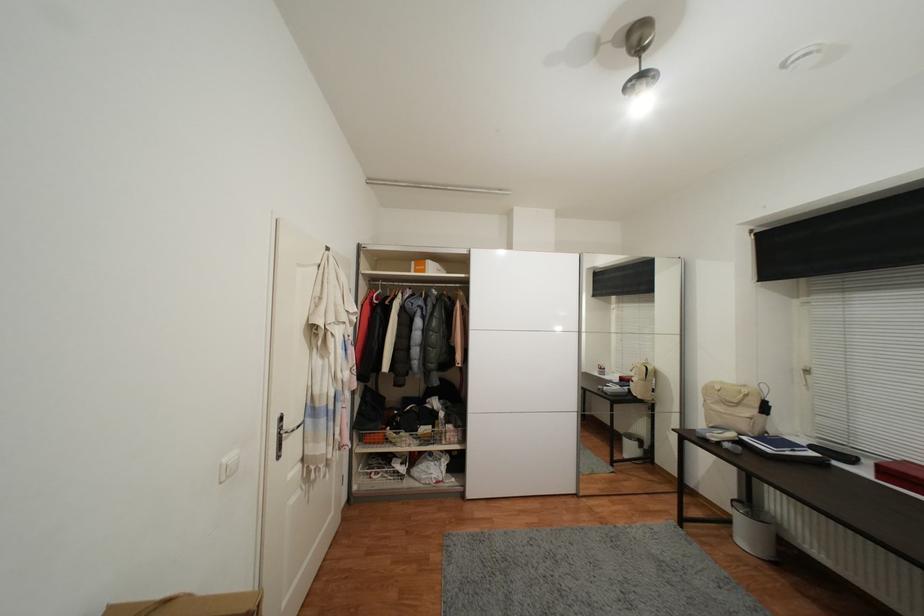
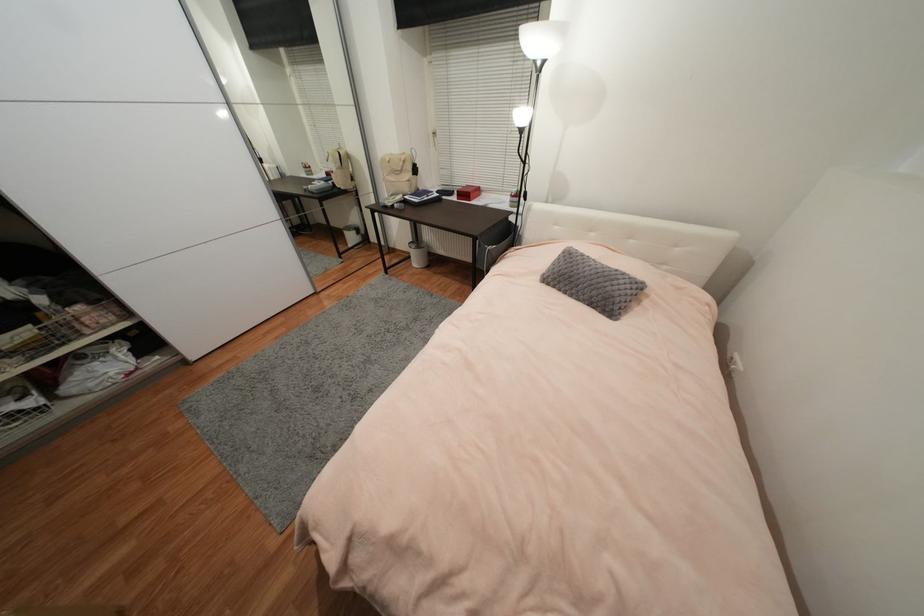
Where in the second image is the point corresponding to pixel 748 430 from the first image?

(410, 191)